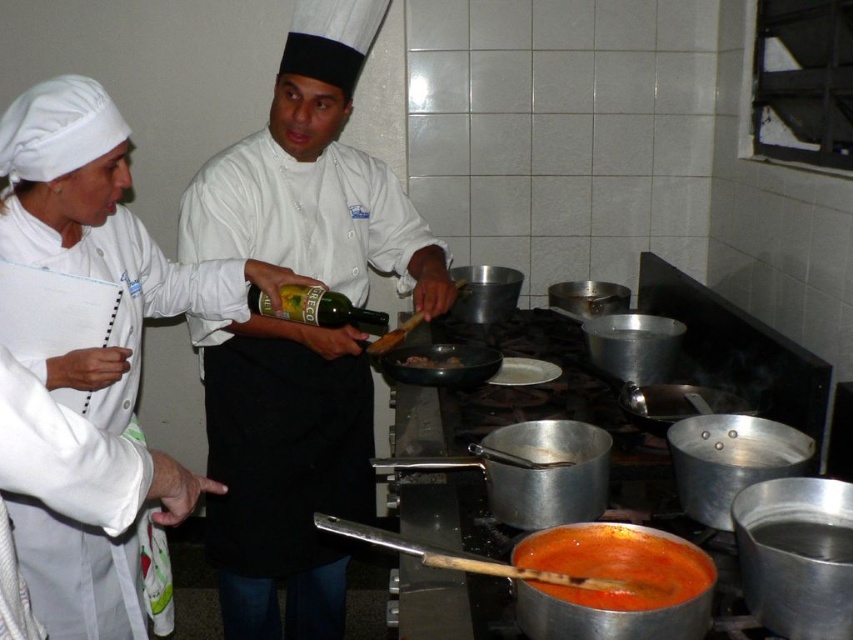
Question: Considering the real-world distances, which object is closest to the white glossy chef coat at left?

Choices:
 (A) tomato sauce at lower center
 (B) brown matte pan at center
 (C) green glass bottle at center
 (D) white glossy chef hat at center

Answer: (C)

Question: Is white matte exhaust hood at upper center positioned before brown matte pan at center?

Choices:
 (A) yes
 (B) no

Answer: (A)

Question: Estimate the real-world distances between objects in this image. Which object is closer to the green glass bottle at center?

Choices:
 (A) brown matte pan at center
 (B) white matte exhaust hood at upper center

Answer: (A)

Question: Estimate the real-world distances between objects in this image. Which object is farther from the brown matte pan at center?

Choices:
 (A) white glossy chef coat at left
 (B) white matte exhaust hood at upper center
 (C) tomato sauce at lower center
 (D) white glossy chef hat at center

Answer: (C)

Question: Does white glossy chef coat at left come behind green glass bottle at center?

Choices:
 (A) no
 (B) yes

Answer: (A)

Question: Does white matte exhaust hood at upper center have a greater width compared to brown matte pan at center?

Choices:
 (A) yes
 (B) no

Answer: (A)